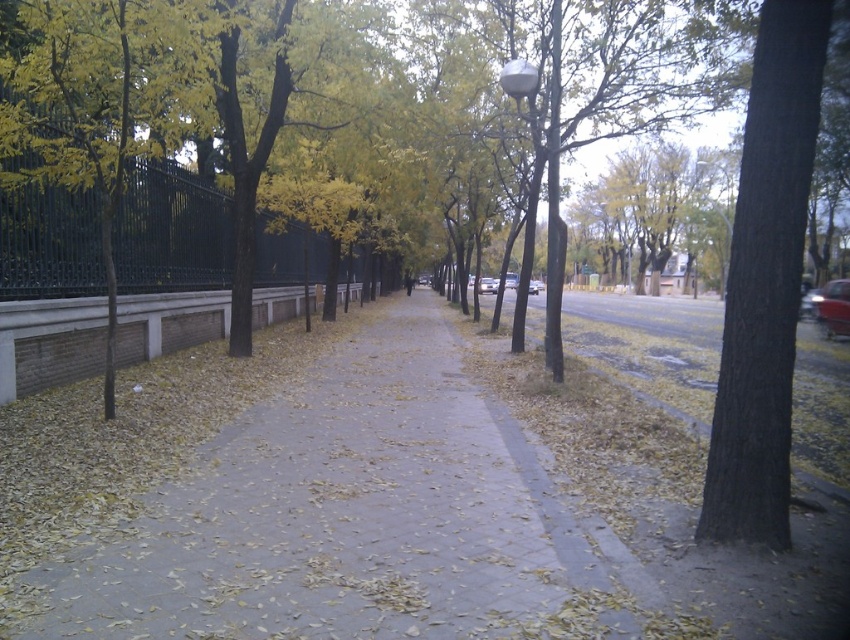
You are standing at the center of the pathway in the image. Looking towards the right side, you see a dark brown textured tree trunk at right. What are the coordinates of this tree trunk in the image?

The coordinates of the dark brown textured tree trunk at right are at point (x=765, y=282).

You are standing at the start of the pathway and want to walk straight ahead towards the dark brown textured tree trunk at right. How far will you have to walk to reach it?

The dark brown textured tree trunk at right is 4.12 meters away from the viewer, so you will have to walk 4.12 meters to reach it.